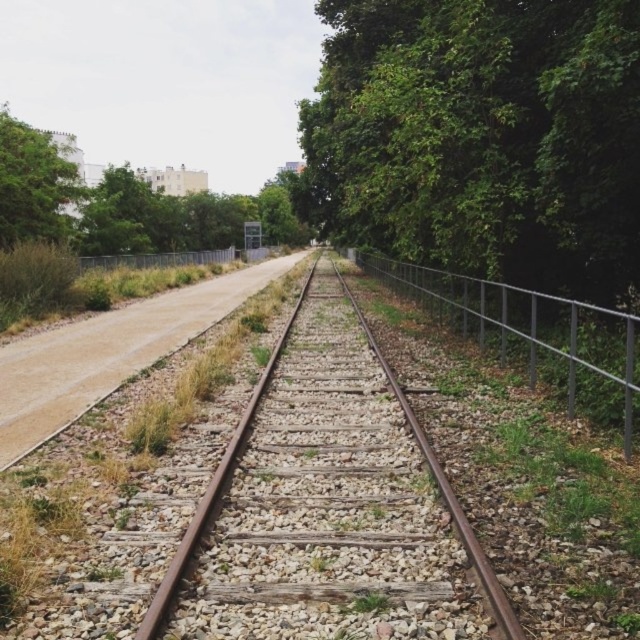
You are standing at the starting point of the railway track. There is a green leafy tree at center. Can you see the point at coordinates point [481,138] from your current position?

The point [481,138] corresponds to the green leafy tree at center, so yes, you can see the point from your current position.

You are standing at the edge of the railway tracks and see two points marked on the tracks. The first point is at coordinates point (552,67) and the second point is at point (209,324). Which point is closer to you?

Point (552,67) is closer to the viewer than point (209,324).

You are a train engineer preparing to cross a railway track. You notice two green leafy trees in the scene. Which tree is closer to the tracks, the green leafy tree at center or the green leafy tree at upper left?

The green leafy tree at center is positioned under the green leafy tree at upper left, meaning it is closer to the tracks.